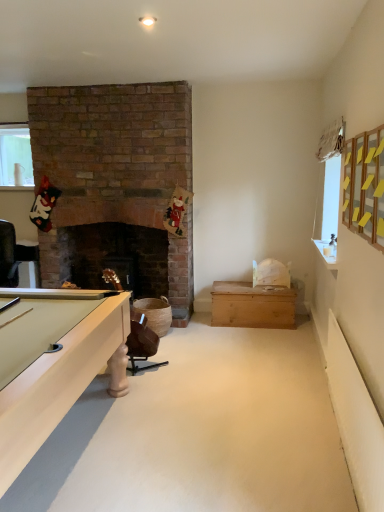
Question: Choose the correct answer: Is clear glass vase at upper left inside wooden chest at center or outside it?

Choices:
 (A) inside
 (B) outside

Answer: (B)

Question: Considering the positions of point (8, 179) and point (278, 324), is point (8, 179) closer or farther from the camera than point (278, 324)?

Choices:
 (A) farther
 (B) closer

Answer: (A)

Question: Which object is the closest to the white glossy counter top at upper right?

Choices:
 (A) wooden chest at center
 (B) brown leather chair at lower center
 (C) clear glass vase at upper left

Answer: (A)

Question: Which is farther from the white glossy counter top at upper right?

Choices:
 (A) wooden chest at center
 (B) clear glass vase at upper left
 (C) brown leather chair at lower center

Answer: (B)